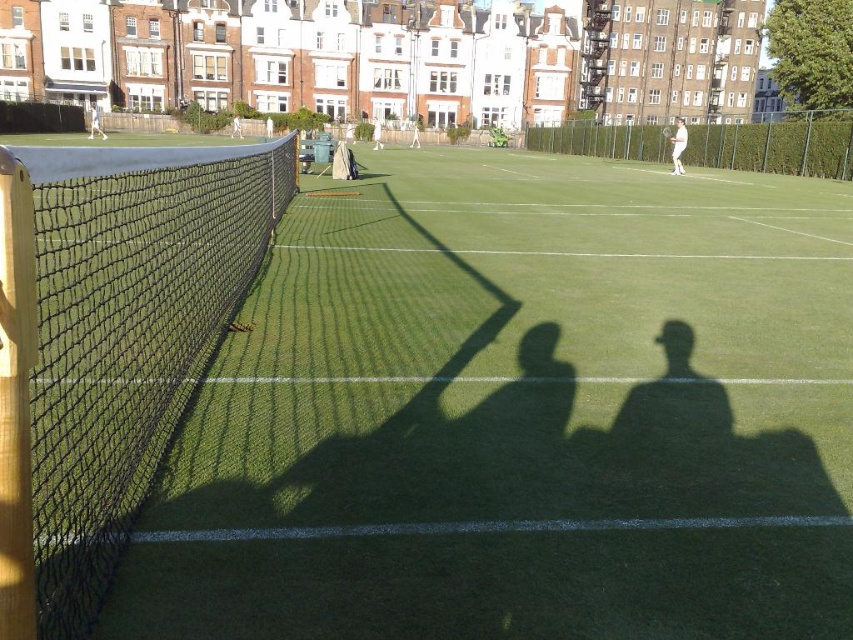
What do you see at coordinates (96, 122) in the screenshot? The image size is (853, 640). I see `white fabric tennis racket at upper left` at bounding box center [96, 122].

Identify the location of white fabric tennis racket at upper left. The width and height of the screenshot is (853, 640). (96, 122).

Based on the photo, who is more distant from viewer, [94,102] or [660,131]?

The point [94,102] is more distant.

Image resolution: width=853 pixels, height=640 pixels. I want to click on white fabric tennis racket at upper left, so click(x=96, y=122).

Is white cotton tennis racket at right smaller than white fabric tennis racket at upper center?

Incorrect, white cotton tennis racket at right is not smaller in size than white fabric tennis racket at upper center.

Is white cotton tennis racket at right shorter than white fabric tennis racket at upper center?

In fact, white cotton tennis racket at right may be taller than white fabric tennis racket at upper center.

Between point (676, 154) and point (241, 129), which one is positioned in front?

Point (676, 154) is in front.

Where is `white cotton tennis racket at right`? Image resolution: width=853 pixels, height=640 pixels. white cotton tennis racket at right is located at coordinates (677, 145).

What do you see at coordinates (125, 333) in the screenshot? This screenshot has height=640, width=853. I see `black mesh net at left` at bounding box center [125, 333].

Is black mesh net at left bigger than white fabric tennis racket at upper left?

Actually, black mesh net at left might be smaller than white fabric tennis racket at upper left.

The image size is (853, 640). In order to click on black mesh net at left in this screenshot , I will do `click(125, 333)`.

What are the coordinates of `black mesh net at left` in the screenshot? It's located at (125, 333).